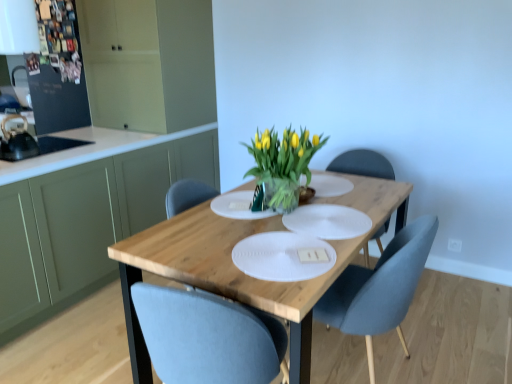
Question: From a real-world perspective, is wooden table at center physically located above or below green matte cabinet at left, which is the 1th cabinetry from top to bottom?

Choices:
 (A) below
 (B) above

Answer: (A)

Question: Is wooden table at center taller or shorter than green matte cabinet at left, which is the 1th cabinetry from top to bottom?

Choices:
 (A) short
 (B) tall

Answer: (A)

Question: Which object is the farthest from the white textured placemat at center?

Choices:
 (A) green matte cabinet at left, the second cabinetry positioned from the top
 (B) matte black refrigerator at upper left, placed as the 2th appliance when sorted from front to back
 (C) green matte cabinet at left, placed as the 2th cabinetry when sorted from bottom to top
 (D) matte gray chair at center
 (E) black matte kettle at left, the 1th appliance from the front

Answer: (E)

Question: Which is farther from the matte black refrigerator at upper left, arranged as the first appliance when viewed from the back?

Choices:
 (A) green matte cabinet at left, which is the 1th cabinetry from top to bottom
 (B) matte gray chair at center
 (C) green matte cabinet at left, which is the 1th cabinetry in bottom-to-top order
 (D) translucent glass vase at center
 (E) white textured placemat at center

Answer: (B)